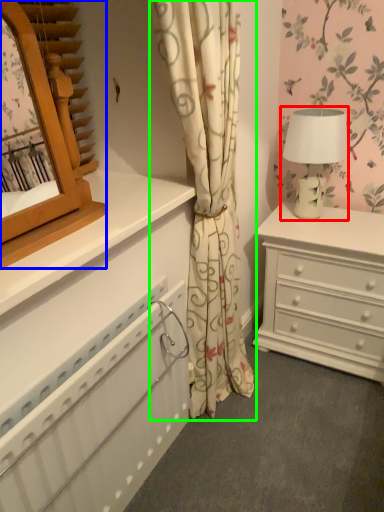
Question: Which object is the closest to the table lamp (highlighted by a red box)? Choose among these: mirror (highlighted by a blue box) or curtain (highlighted by a green box).

Choices:
 (A) mirror
 (B) curtain

Answer: (B)